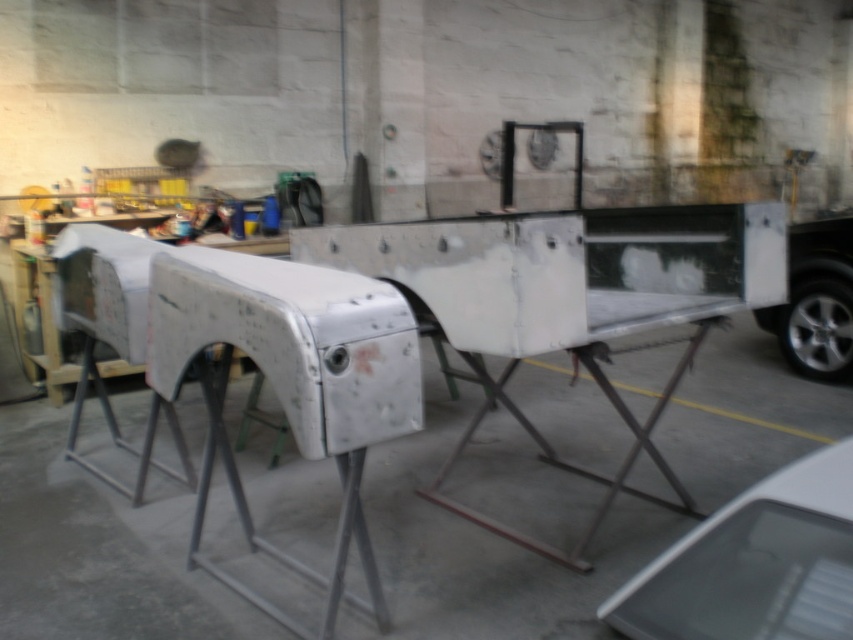
Question: Which object is farther from the camera taking this photo?

Choices:
 (A) silver metallic car at right
 (B) white matte car at lower right

Answer: (A)

Question: Among these objects, which one is farthest from the camera?

Choices:
 (A) white matte car at lower right
 (B) silver metallic car at right

Answer: (B)

Question: In this image, where is white matte car at lower right located relative to silver metallic car at right?

Choices:
 (A) below
 (B) above

Answer: (A)

Question: Is white matte car at lower right positioned before silver metallic car at right?

Choices:
 (A) no
 (B) yes

Answer: (B)

Question: Is white matte car at lower right closer to the viewer compared to silver metallic car at right?

Choices:
 (A) yes
 (B) no

Answer: (A)